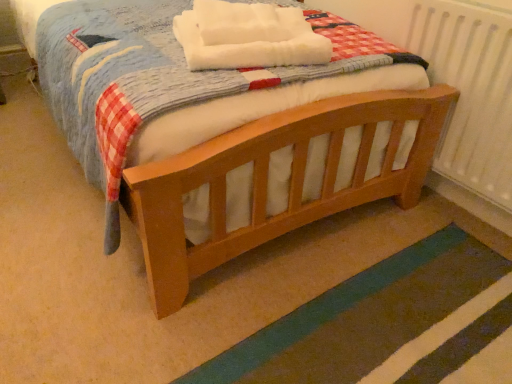
Where is `vacant space to the left of white textured radiator at right`? The image size is (512, 384). vacant space to the left of white textured radiator at right is located at coordinates (361, 225).